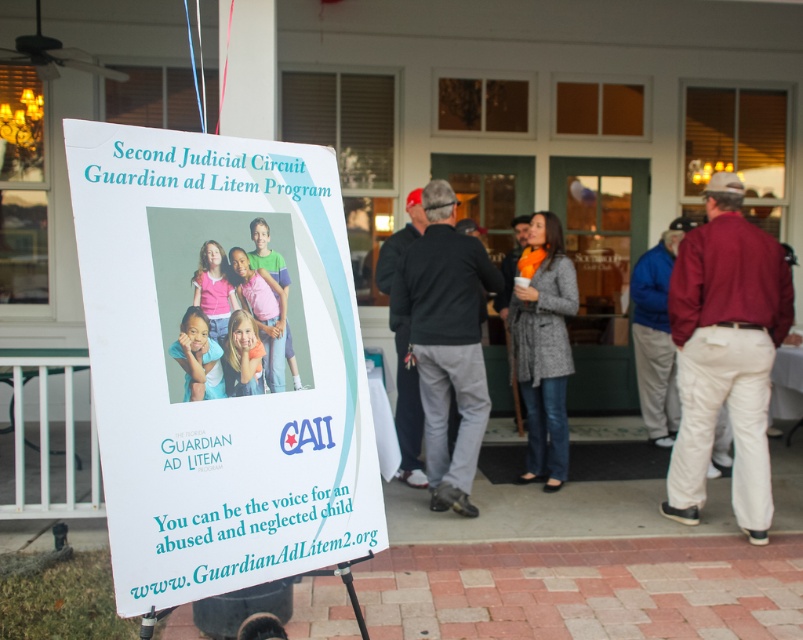
Question: Estimate the real-world distances between objects in this image. Which object is farther from the gray wool coat at center?

Choices:
 (A) blonde hair girl at center
 (B) matte skin tone at center
 (C) maroon shirt at right

Answer: (B)

Question: Which object is closer to the camera taking this photo?

Choices:
 (A) maroon shirt at right
 (B) pink fabric shirt at center
 (C) matte skin tone at center

Answer: (C)

Question: Can you confirm if pink fabric shirt at center is wider than multicolored t-shirt at center?

Choices:
 (A) no
 (B) yes

Answer: (A)

Question: In this image, where is black sweater at center located relative to gray wool coat at center?

Choices:
 (A) below
 (B) above

Answer: (B)

Question: Is gray wool coat at center positioned at the back of multicolored t-shirt at center?

Choices:
 (A) no
 (B) yes

Answer: (B)

Question: Which point appears farthest from the camera in this image?

Choices:
 (A) (x=225, y=576)
 (B) (x=241, y=346)
 (C) (x=288, y=353)
 (D) (x=221, y=272)

Answer: (C)